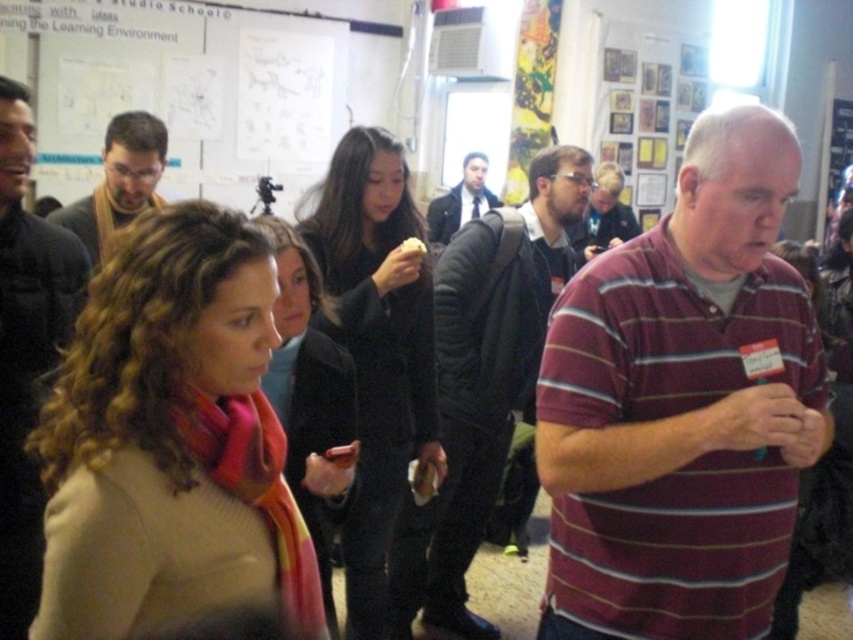
Question: Which point is farther to the camera?

Choices:
 (A) beige wool scarf at center
 (B) multicolored scarf at center

Answer: (B)

Question: Can you confirm if dark gray scarf at center is positioned to the right of dark suit jacket at center?

Choices:
 (A) no
 (B) yes

Answer: (A)

Question: Which point appears farthest from the camera in this image?

Choices:
 (A) tap(747, 532)
 (B) tap(482, 198)
 (C) tap(299, 419)
 (D) tap(456, 413)

Answer: (B)

Question: Considering the real-world distances, which object is farthest from the multicolored scarf at center?

Choices:
 (A) dark gray scarf at center
 (B) beige wool scarf at center

Answer: (A)

Question: Is beige wool scarf at center thinner than dark brown leather jacket at center?

Choices:
 (A) no
 (B) yes

Answer: (A)

Question: Does dark gray scarf at center appear over dark suit jacket at center?

Choices:
 (A) no
 (B) yes

Answer: (A)